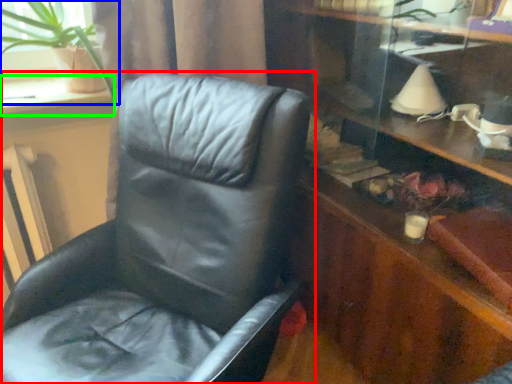
Question: Estimate the real-world distances between objects in this image. Which object is closer to chair (highlighted by a red box), houseplant (highlighted by a blue box) or window sill (highlighted by a green box)?

Choices:
 (A) houseplant
 (B) window sill

Answer: (A)